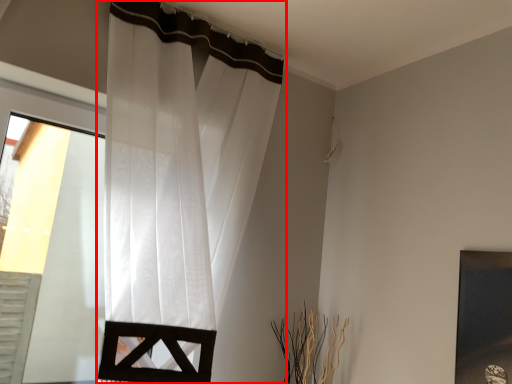
Question: Observing the image, what is the correct spatial positioning of curtain (annotated by the red box) in reference to picture frame?

Choices:
 (A) right
 (B) left

Answer: (B)